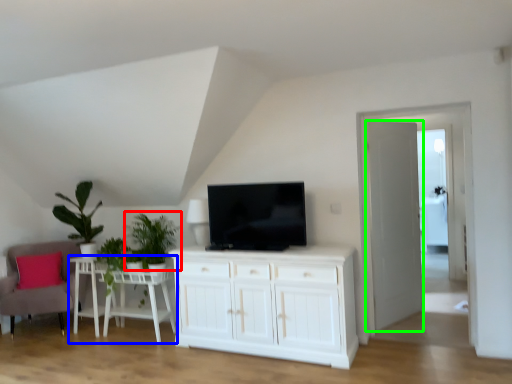
Question: Considering the real-world distances, which object is farthest from plant (highlighted by a red box)? table (highlighted by a blue box) or door (highlighted by a green box)?

Choices:
 (A) table
 (B) door

Answer: (B)